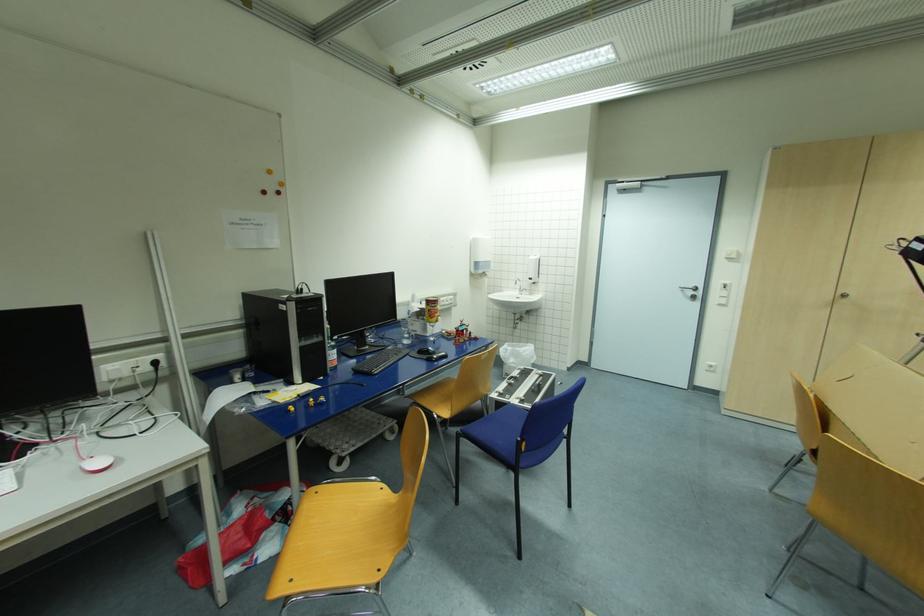
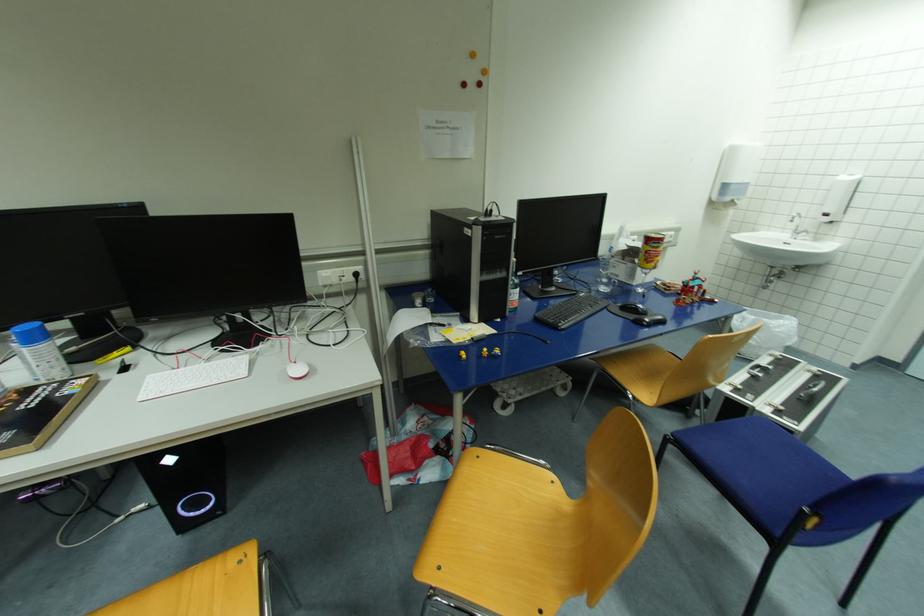
Question: How did the camera likely rotate?

Choices:
 (A) Left
 (B) Right
 (C) Up
 (D) Down

Answer: (A)